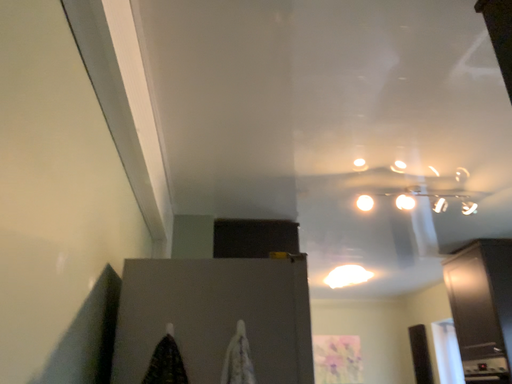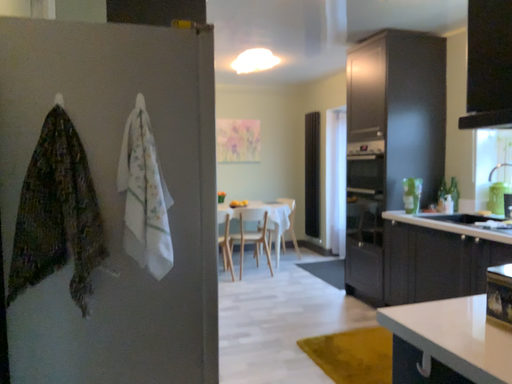
Question: Which way did the camera rotate in the video?

Choices:
 (A) rotated right
 (B) rotated left

Answer: (A)